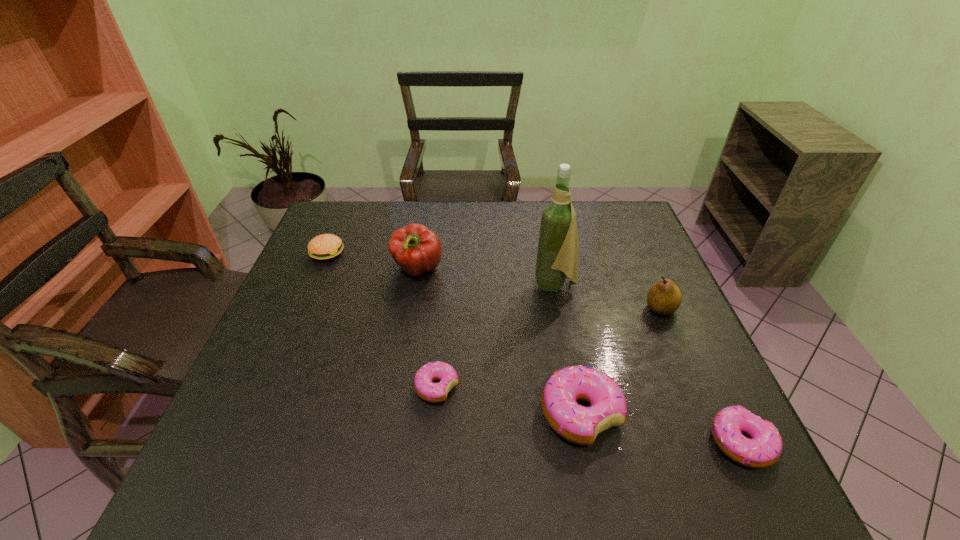
Find the location of a particular element. vacant space located 0.390m on the back of the fourth shortest object is located at coordinates coord(553,268).

Image resolution: width=960 pixels, height=540 pixels. What are the coordinates of `free space located on the back of the rightmost doughnut` in the screenshot? It's located at (682, 318).

This screenshot has height=540, width=960. Find the location of `free space located on the front-facing side of the tallest object`. free space located on the front-facing side of the tallest object is located at coordinates pyautogui.click(x=512, y=285).

The height and width of the screenshot is (540, 960). I want to click on vacant space situated on the front-facing side of the tallest object, so click(419, 285).

Locate an element on the screen. vacant area situated 0.340m on the front-facing side of the tallest object is located at coordinates 412,285.

Locate an element on the screen. This screenshot has width=960, height=540. vacant space located 0.280m on the left of the second tallest object is located at coordinates (296, 270).

At what (x,y) coordinates should I click in order to perform the action: click on free location located on the front of the pear. Please return your answer as a coordinate pair (x, y). The height and width of the screenshot is (540, 960). Looking at the image, I should click on (682, 358).

Locate an element on the screen. The image size is (960, 540). vacant space situated 0.070m on the back of the patty is located at coordinates (x=337, y=230).

This screenshot has height=540, width=960. I want to click on object located in the far edge section of the desktop, so click(x=326, y=246).

In order to click on object present at the left edge in this screenshot , I will do `click(326, 246)`.